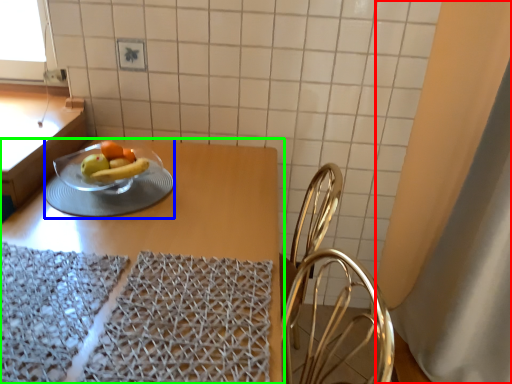
Question: Which object is positioned closest to curtain (highlighted by a red box)? Select from tableware (highlighted by a blue box) and table (highlighted by a green box).

Choices:
 (A) tableware
 (B) table

Answer: (B)